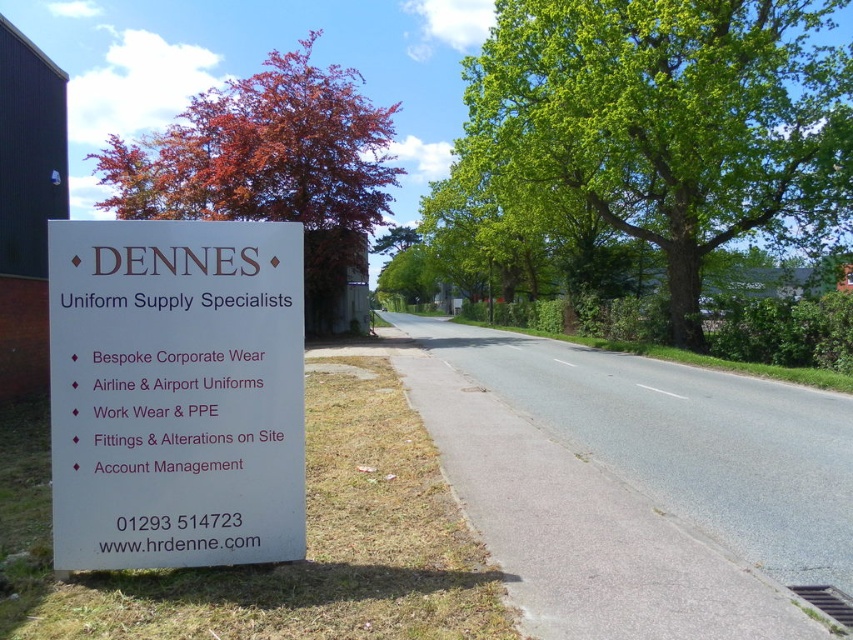
Who is shorter, green leafy tree at upper right or reddish-brown bark tree at upper left?

green leafy tree at upper right

The width and height of the screenshot is (853, 640). Find the location of `green leafy tree at upper right`. green leafy tree at upper right is located at coordinates (654, 128).

Locate an element on the screen. Image resolution: width=853 pixels, height=640 pixels. green leafy tree at upper right is located at coordinates tap(654, 128).

Is white plastic sign at left above reddish-brown bark tree at upper left?

Actually, white plastic sign at left is below reddish-brown bark tree at upper left.

Who is more distant from viewer, (85, 236) or (276, 148)?

The point (276, 148) is behind.

Measure the distance between point (164,227) and camera.

Point (164,227) and camera are 4.15 meters apart from each other.

The height and width of the screenshot is (640, 853). I want to click on white plastic sign at left, so click(x=175, y=394).

Between green leafy tree at upper right and white plastic sign at left, which one appears on the left side from the viewer's perspective?

white plastic sign at left

Is green leafy tree at upper right smaller than white plastic sign at left?

No.

Is point (698, 13) positioned behind point (292, 241)?

Yes, point (698, 13) is behind point (292, 241).

You are a GUI agent. You are given a task and a screenshot of the screen. Output one action in this format:
    pyautogui.click(x=<x>, y=<y>)
    Task: Click on the green leafy tree at upper right
    
    Given the screenshot: What is the action you would take?
    pyautogui.click(x=654, y=128)